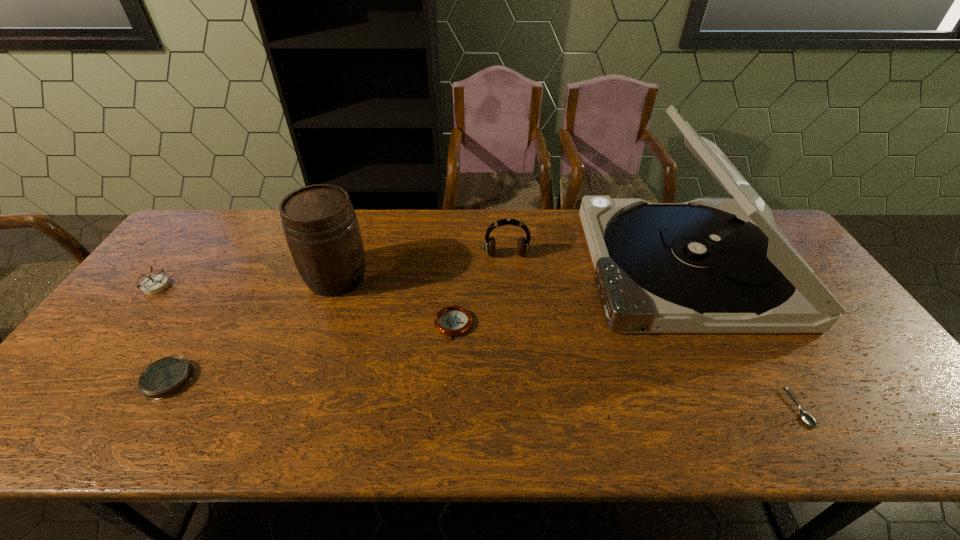
The height and width of the screenshot is (540, 960). Find the location of `blank space at the right edge of the desktop`. blank space at the right edge of the desktop is located at coordinates (851, 328).

Identify the location of vacant space at the near right corner of the desktop. (925, 424).

Locate an element on the screen. The image size is (960, 540). free spot between the rightmost compass and the soupspoon is located at coordinates (626, 367).

The height and width of the screenshot is (540, 960). Identify the location of free spot between the second compass from right to left and the second nearest compass. (311, 352).

Image resolution: width=960 pixels, height=540 pixels. In order to click on free area in between the fourth object from left to right and the nearest compass in this screenshot , I will do `click(311, 352)`.

In order to click on free space that is in between the nearest compass and the fourth object from left to right in this screenshot , I will do `click(311, 352)`.

Where is `free space between the shortest object and the nearest compass`? free space between the shortest object and the nearest compass is located at coordinates (483, 394).

Where is `vacant area that lies between the CD player and the rightmost compass`? vacant area that lies between the CD player and the rightmost compass is located at coordinates (568, 296).

Find the location of a particular element. Image resolution: width=960 pixels, height=540 pixels. vacant space in between the headset and the fourth object from right to left is located at coordinates (480, 291).

The height and width of the screenshot is (540, 960). Find the location of `blank region between the soupspoon and the second farthest compass`. blank region between the soupspoon and the second farthest compass is located at coordinates (626, 367).